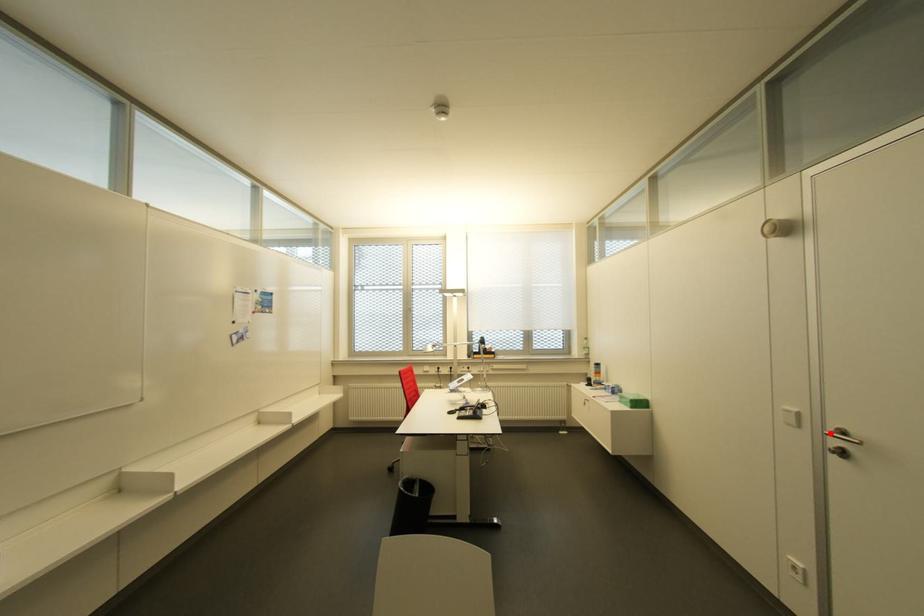
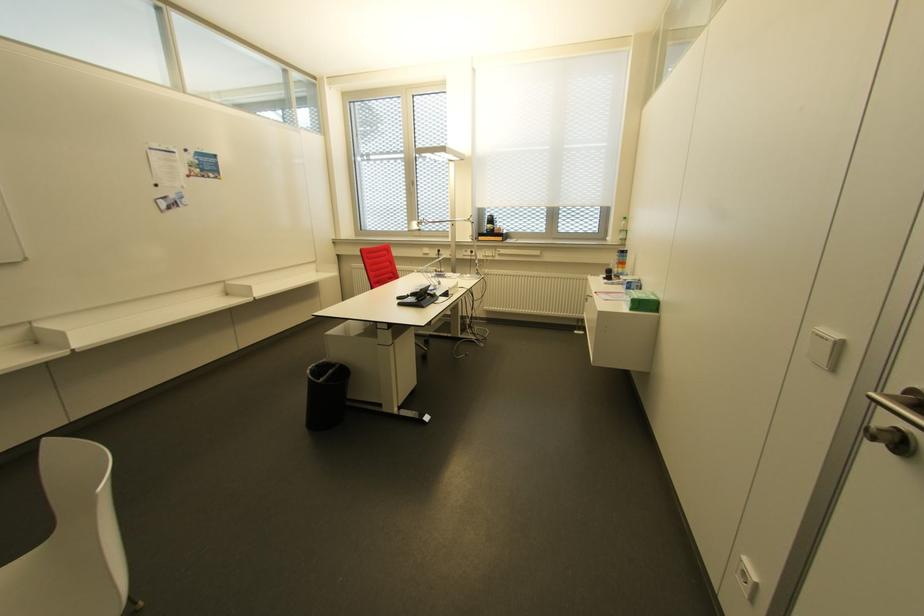
Find the pixel in the second image that matches the highlighted location in the first image.

(888, 397)